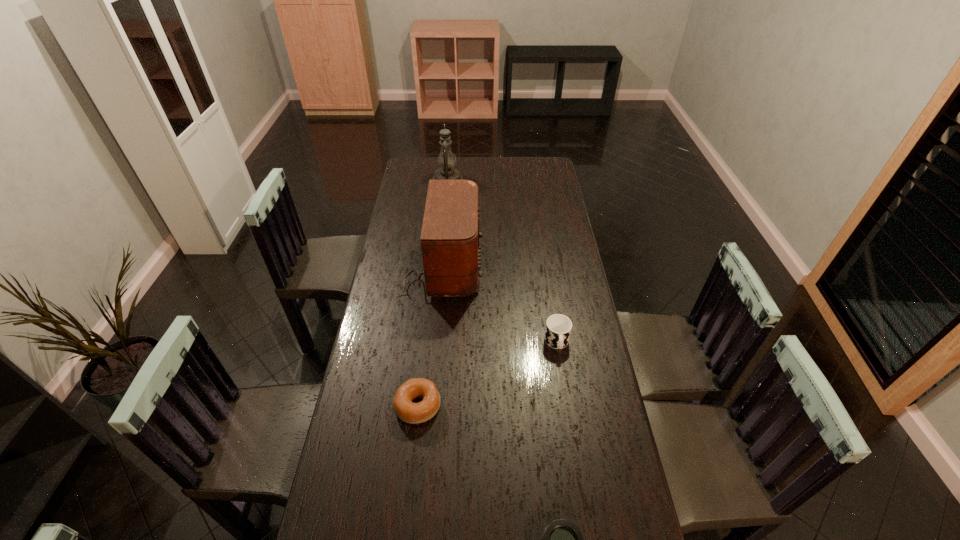
Where is `red fire extinguisher`? The image size is (960, 540). red fire extinguisher is located at coordinates (491, 103).

At what (x,y) coordinates should I click in order to perform the action: click on the tallest object. Please return your answer as a coordinate pair (x, y). Looking at the image, I should click on (491, 103).

The image size is (960, 540). Identify the location of the third sunflower from right to left. (487, 207).

This screenshot has width=960, height=540. Identify the location of the leftmost yellow sunflower. (487, 207).

The height and width of the screenshot is (540, 960). Identify the location of the biggest green sunflower. (425, 157).

You are a GUI agent. You are given a task and a screenshot of the screen. Output one action in this format:
    pyautogui.click(x=<x>, y=<y>)
    Task: Click on the farthest sunflower
    This screenshot has height=540, width=960.
    Given the screenshot: What is the action you would take?
    pyautogui.click(x=425, y=157)

The width and height of the screenshot is (960, 540). Find the location of `carton`. carton is located at coordinates (550, 131).

The width and height of the screenshot is (960, 540). Find the location of `the nearest yellow sunflower`. the nearest yellow sunflower is located at coordinates (544, 302).

I want to click on the third nearest object, so click(544, 302).

At what (x,y) coordinates should I click in order to perform the action: click on the seventh farthest object. Please return your answer as a coordinate pair (x, y). Looking at the image, I should click on (420, 342).